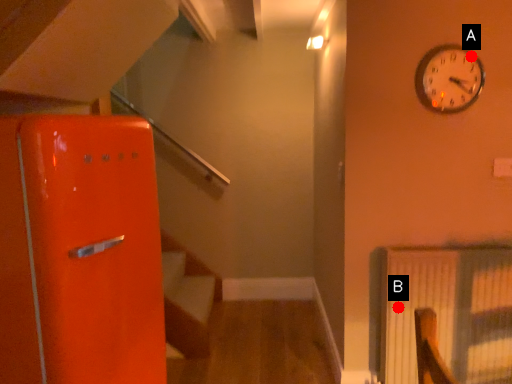
Question: Two points are circled on the image, labeled by A and B beside each circle. Which point is farther from the camera taking this photo?

Choices:
 (A) A is further
 (B) B is further

Answer: (B)